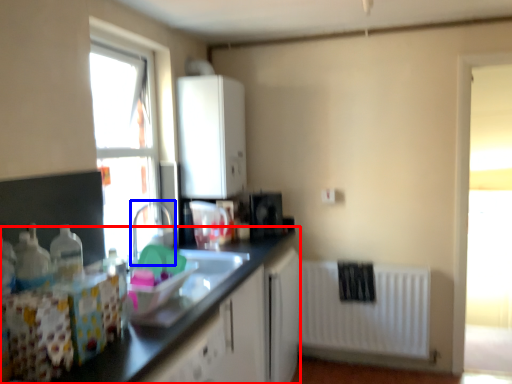
Question: Which object appears closest to the camera in this image, countertop (highlighted by a red box) or faucet (highlighted by a blue box)?

Choices:
 (A) countertop
 (B) faucet

Answer: (A)